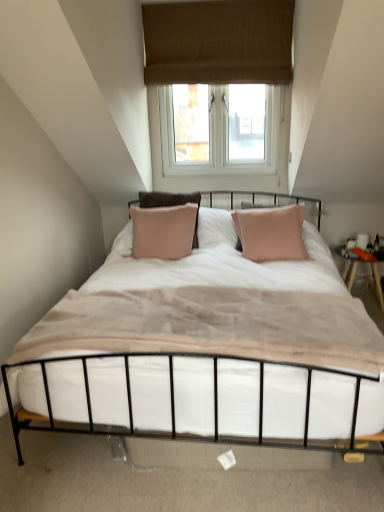
Find the location of a particular element. white soft mattress at center is located at coordinates (212, 326).

Measure the distance between point [209,316] and camera.

Point [209,316] is 6.06 feet away from camera.

Locate an element on the screen. The height and width of the screenshot is (512, 384). metallic white bed at center is located at coordinates pos(205,348).

In the scene shown: Which object is thinner, wooden nightstand at right or white soft mattress at center?

With smaller width is wooden nightstand at right.

Is wooden nightstand at right positioned with its back to white soft mattress at center?

wooden nightstand at right is not turned away from white soft mattress at center.

How different are the orientations of wooden nightstand at right and white soft mattress at center in degrees?

wooden nightstand at right and white soft mattress at center are facing 0.741 degrees away from each other.

Is wooden nightstand at right behind white soft mattress at center?

Yes.

At what (x,y) coordinates should I click in order to perform the action: click on nightstand on the right of metallic white bed at center. Please return your answer as a coordinate pair (x, y). Looking at the image, I should click on (350, 263).

How much distance is there between metallic white bed at center and wooden nightstand at right?

metallic white bed at center and wooden nightstand at right are 1.56 meters apart from each other.

Between metallic white bed at center and wooden nightstand at right, which one appears on the left side from the viewer's perspective?

metallic white bed at center is more to the left.

Is white soft mattress at center outside of brown fabric window at upper center?

Yes, white soft mattress at center is outside of brown fabric window at upper center.

Does white soft mattress at center have a lesser width compared to brown fabric window at upper center?

No.

In the image, is white soft mattress at center positioned in front of or behind brown fabric window at upper center?

Visually, white soft mattress at center is located in front of brown fabric window at upper center.

At what (x,y) coordinates should I click in order to perform the action: click on mattress in front of the brown fabric window at upper center. Please return your answer as a coordinate pair (x, y). The image size is (384, 512). Looking at the image, I should click on (212, 326).

Which of these two, brown fabric window at upper center or metallic white bed at center, is wider?

metallic white bed at center.

Is brown fabric window at upper center situated inside metallic white bed at center or outside?

brown fabric window at upper center is not inside metallic white bed at center, it's outside.

From the image's perspective, which is above, brown fabric window at upper center or metallic white bed at center?

brown fabric window at upper center.

Considering the relative positions of brown fabric window at upper center and metallic white bed at center in the image provided, is brown fabric window at upper center to the left of metallic white bed at center from the viewer's perspective?

Indeed, brown fabric window at upper center is positioned on the left side of metallic white bed at center.

From a real-world perspective, which object stands above the other?

In real-world perspective, brown fabric window at upper center is above.

Does point (234, 77) come closer to viewer compared to point (374, 260)?

No, it is behind (374, 260).

Is brown fabric window at upper center looking in the opposite direction of wooden nightstand at right?

brown fabric window at upper center does not have its back to wooden nightstand at right.

Is brown fabric window at upper center outside of wooden nightstand at right?

Yes, brown fabric window at upper center is located beyond the bounds of wooden nightstand at right.

Considering the positions of objects metallic white bed at center and white soft mattress at center in the image provided, who is more to the left, metallic white bed at center or white soft mattress at center?

white soft mattress at center.

From a real-world perspective, who is located lower, metallic white bed at center or white soft mattress at center?

In real-world perspective, metallic white bed at center is lower.

Is metallic white bed at center closer to the viewer compared to white soft mattress at center?

That is True.

Is point (297, 287) closer or farther from the camera than point (239, 294)?

Point (297, 287).

Could white soft mattress at center be considered to be inside brown fabric window at upper center?

No, white soft mattress at center is not inside brown fabric window at upper center.

Could you tell me if brown fabric window at upper center is turned towards white soft mattress at center?

Yes, brown fabric window at upper center is turned towards white soft mattress at center.

Between brown fabric window at upper center and white soft mattress at center, which one has larger size?

Bigger between the two is white soft mattress at center.

Is brown fabric window at upper center to the left of white soft mattress at center from the viewer's perspective?

Incorrect, brown fabric window at upper center is not on the left side of white soft mattress at center.

Locate an element on the screen. mattress in front of the wooden nightstand at right is located at coordinates (212, 326).

At what (x,y) coordinates should I click in order to perform the action: click on nightstand behind the metallic white bed at center. Please return your answer as a coordinate pair (x, y). This screenshot has width=384, height=512. Looking at the image, I should click on (350, 263).

From the image, which object appears to be farther from metallic white bed at center, wooden nightstand at right or white soft mattress at center?

wooden nightstand at right.

Estimate the real-world distances between objects in this image. Which object is closer to brown fabric window at upper center, wooden nightstand at right or metallic white bed at center?

metallic white bed at center is closer to brown fabric window at upper center.

When comparing their distances from brown fabric window at upper center, does metallic white bed at center or white soft mattress at center seem further?

Based on the image, white soft mattress at center appears to be further to brown fabric window at upper center.

Based on the photo, based on their spatial positions, is white soft mattress at center or wooden nightstand at right further from brown fabric window at upper center?

white soft mattress at center is further to brown fabric window at upper center.

Which object lies further to the anchor point metallic white bed at center, brown fabric window at upper center or white soft mattress at center?

brown fabric window at upper center lies further to metallic white bed at center than the other object.

When comparing their distances from wooden nightstand at right, does white soft mattress at center or metallic white bed at center seem further?

white soft mattress at center is further to wooden nightstand at right.

Estimate the real-world distances between objects in this image. Which object is further from white soft mattress at center, wooden nightstand at right or brown fabric window at upper center?

brown fabric window at upper center is positioned further to the anchor white soft mattress at center.

Looking at the image, which one is located closer to white soft mattress at center, brown fabric window at upper center or metallic white bed at center?

Among the two, metallic white bed at center is located nearer to white soft mattress at center.

Locate an element on the screen. nightstand between brown fabric window at upper center and metallic white bed at center vertically is located at coordinates (350, 263).

Locate an element on the screen. The image size is (384, 512). nightstand positioned between white soft mattress at center and brown fabric window at upper center from near to far is located at coordinates (350, 263).

You are a GUI agent. You are given a task and a screenshot of the screen. Output one action in this format:
    pyautogui.click(x=<x>, y=<y>)
    Task: Click on the mattress that lies between brown fabric window at upper center and metallic white bed at center from top to bottom
    Image resolution: width=384 pixels, height=512 pixels.
    Given the screenshot: What is the action you would take?
    pyautogui.click(x=212, y=326)

Find the location of a particular element. The height and width of the screenshot is (512, 384). mattress located between metallic white bed at center and wooden nightstand at right in the depth direction is located at coordinates (212, 326).